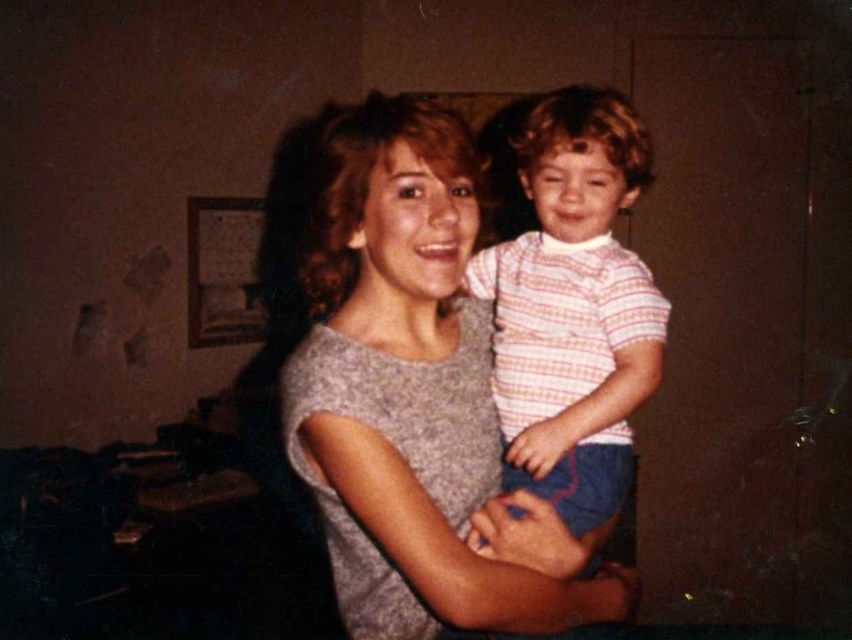
Does gray matte shirt at center appear over striped cotton shirt at center?

Actually, gray matte shirt at center is below striped cotton shirt at center.

Is point (465, 148) farther from camera compared to point (560, 500)?

No.

Does point (412, 472) come farther from viewer compared to point (655, 301)?

No.

Where is `gray matte shirt at center`? The height and width of the screenshot is (640, 852). gray matte shirt at center is located at coordinates (410, 392).